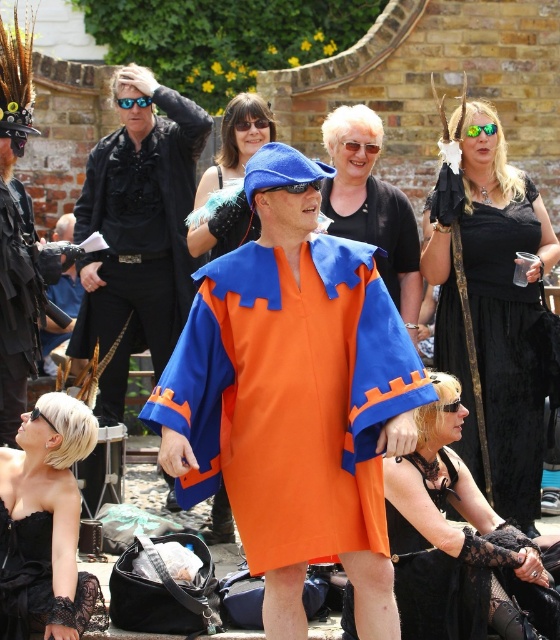
Question: Which point appears closest to the camera in this image?

Choices:
 (A) (500, 561)
 (B) (238, 125)
 (C) (410, 262)

Answer: (A)

Question: Is black velvet dress at center thinner than orange cotton robe at center?

Choices:
 (A) yes
 (B) no

Answer: (B)

Question: Does orange cotton robe at center appear on the right side of black plastic goggles at center?

Choices:
 (A) yes
 (B) no

Answer: (A)

Question: Does matte black robe at left appear on the left side of black plastic goggles at center?

Choices:
 (A) yes
 (B) no

Answer: (A)

Question: Which object appears farthest from the camera in this image?

Choices:
 (A) black plastic goggles at center
 (B) orange cotton robe at center

Answer: (B)

Question: Which object is closer to the camera taking this photo?

Choices:
 (A) black lace gloves at lower right
 (B) green reflective plastic goggles at upper center
 (C) blue plastic goggles at center
 (D) matte black dress at center

Answer: (D)